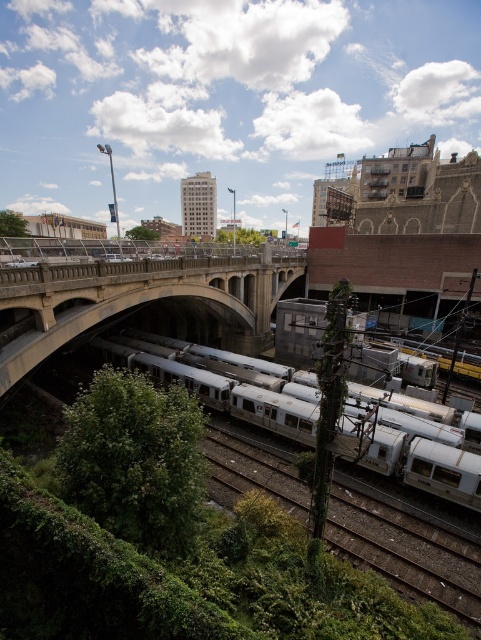
Question: Among these points, which one is farthest from the camera?

Choices:
 (A) (x=101, y=342)
 (B) (x=33, y=269)

Answer: (A)

Question: Which object is positioned closest to the white metallic train at center?

Choices:
 (A) metallic train tracks at lower center
 (B) concrete bridge at left

Answer: (A)

Question: Can you confirm if concrete bridge at left is wider than white metallic train at center?

Choices:
 (A) yes
 (B) no

Answer: (A)

Question: Can you confirm if metallic train tracks at lower center is positioned below white metallic train at center?

Choices:
 (A) no
 (B) yes

Answer: (B)

Question: Which of the following is the farthest from the observer?

Choices:
 (A) (285, 472)
 (B) (250, 307)
 (C) (245, 417)

Answer: (B)

Question: Does concrete bridge at left have a lesser width compared to white metallic train at center?

Choices:
 (A) yes
 (B) no

Answer: (B)